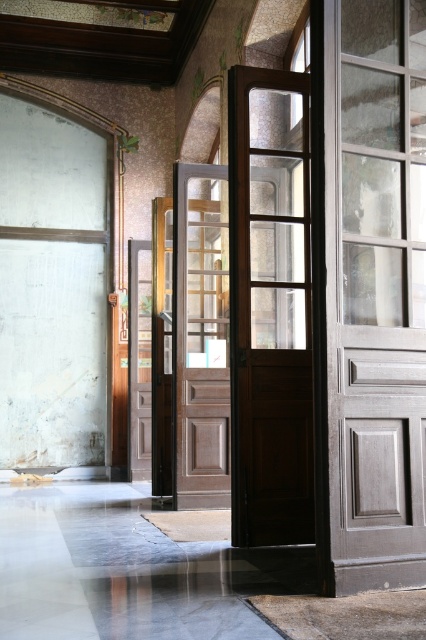
Who is higher up, transparent glass door at center or brown wooden door at center?

Positioned higher is transparent glass door at center.

Which is more to the left, transparent glass door at center or brown wooden door at center?

From the viewer's perspective, brown wooden door at center appears more on the left side.

Where is `transparent glass door at center`? transparent glass door at center is located at coordinates (374, 292).

Can you confirm if transparent glass door at center is positioned to the left of matte brown wooden door at center?

In fact, transparent glass door at center is to the right of matte brown wooden door at center.

Is transparent glass door at center closer to camera compared to matte brown wooden door at center?

Yes, it is.

I want to click on transparent glass door at center, so click(374, 292).

Which is in front, point (245, 86) or point (198, 266)?

Positioned in front is point (245, 86).

Does matte brown wooden door at center have a greater height compared to brown wooden door at center?

Indeed, matte brown wooden door at center has a greater height compared to brown wooden door at center.

Is point (236, 412) closer to viewer compared to point (201, 248)?

Yes, it is.

This screenshot has width=426, height=640. In order to click on matte brown wooden door at center in this screenshot , I will do `click(270, 307)`.